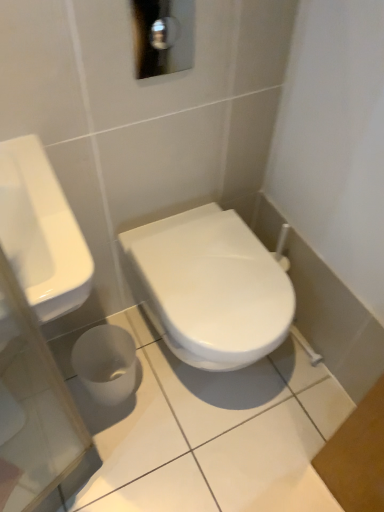
Find the location of a particular element. The height and width of the screenshot is (512, 384). free space above white glossy toilet at center (from a real-world perspective) is located at coordinates (218, 264).